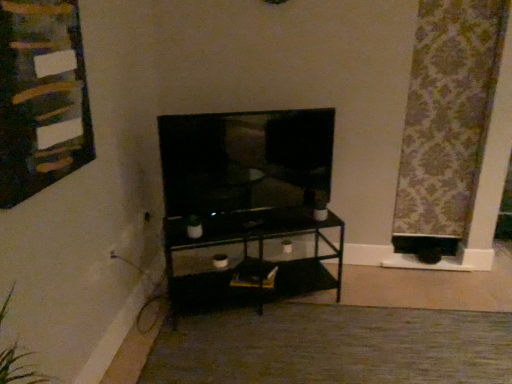
Find the location of a particular element. The width and height of the screenshot is (512, 384). vacant space underneath matte black tv at center (from a real-world perspective) is located at coordinates (249, 218).